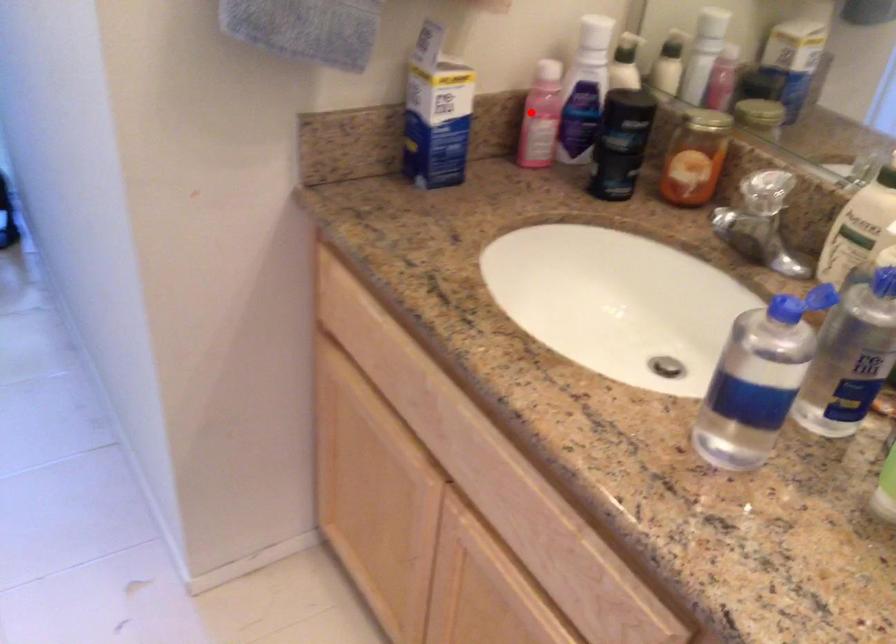
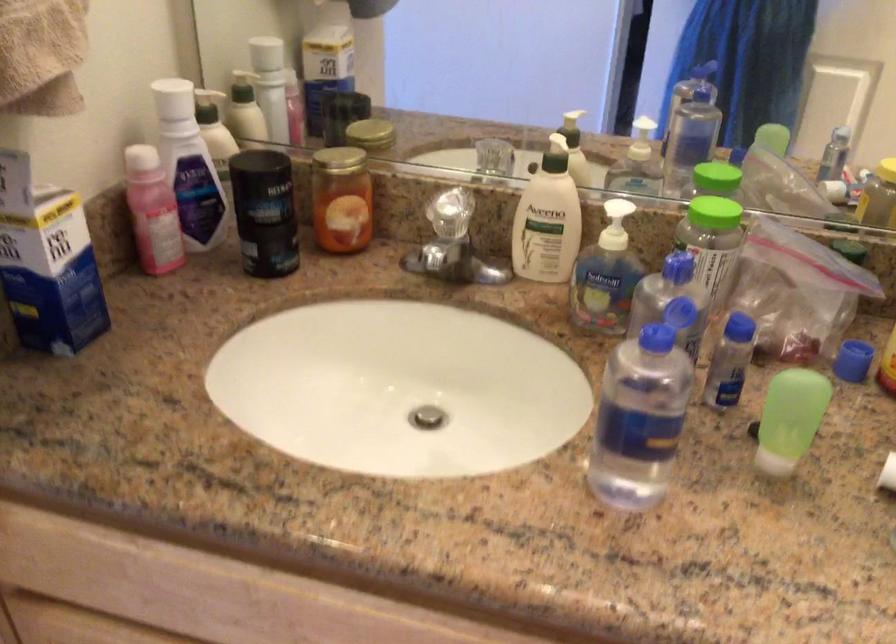
Question: I am providing you with two images of the same scene from different viewpoints. Image1 has a red point marked. In image2, the corresponding 3D location appears at what relative position? Reply with the corresponding letter.

Choices:
 (A) Closer
 (B) Farther

Answer: (A)